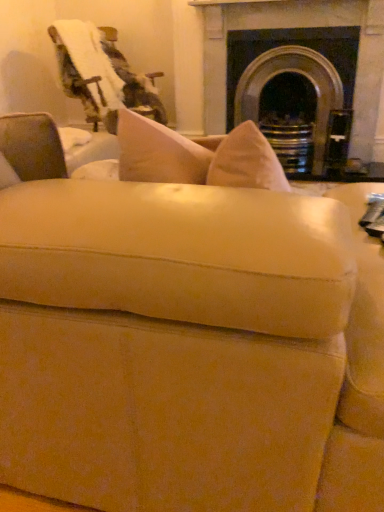
Measure the distance between point (88, 105) and camera.

3.45 meters.

You are a GUI agent. You are given a task and a screenshot of the screen. Output one action in this format:
    pyautogui.click(x=<x>, y=<y>)
    Task: Click on the velvet-like swivel chair at upper left
    
    Given the screenshot: What is the action you would take?
    pyautogui.click(x=101, y=75)

Describe the element at coordinates (101, 75) in the screenshot. I see `velvet-like swivel chair at upper left` at that location.

What are the coordinates of `dark gray stone fireplace at upper center` in the screenshot? It's located at (300, 27).

Describe the element at coordinates (300, 27) in the screenshot. The height and width of the screenshot is (512, 384). I see `dark gray stone fireplace at upper center` at that location.

Identify the location of velvet-like swivel chair at upper left. The height and width of the screenshot is (512, 384). (101, 75).

Which is more to the right, dark gray stone fireplace at upper center or velvet-like swivel chair at upper left?

dark gray stone fireplace at upper center is more to the right.

Is the position of dark gray stone fireplace at upper center more distant than that of velvet-like swivel chair at upper left?

That is True.

Considering the points (374, 73) and (99, 105), which point is in front, point (374, 73) or point (99, 105)?

The point (374, 73) is in front.

From the image's perspective, is dark gray stone fireplace at upper center above velvet-like swivel chair at upper left?

Yes, from the image's perspective, dark gray stone fireplace at upper center is over velvet-like swivel chair at upper left.

From a real-world perspective, which is physically below, dark gray stone fireplace at upper center or velvet-like swivel chair at upper left?

From a 3D spatial view, dark gray stone fireplace at upper center is below.

Looking at their sizes, would you say dark gray stone fireplace at upper center is wider or thinner than velvet-like swivel chair at upper left?

Clearly, dark gray stone fireplace at upper center has less width compared to velvet-like swivel chair at upper left.

Who is taller, dark gray stone fireplace at upper center or velvet-like swivel chair at upper left?

dark gray stone fireplace at upper center.

Considering the relative sizes of dark gray stone fireplace at upper center and velvet-like swivel chair at upper left in the image provided, is dark gray stone fireplace at upper center bigger than velvet-like swivel chair at upper left?

Indeed, dark gray stone fireplace at upper center has a larger size compared to velvet-like swivel chair at upper left.

Is dark gray stone fireplace at upper center spatially inside velvet-like swivel chair at upper left, or outside of it?

dark gray stone fireplace at upper center is outside velvet-like swivel chair at upper left.

Is dark gray stone fireplace at upper center placed right next to velvet-like swivel chair at upper left?

dark gray stone fireplace at upper center and velvet-like swivel chair at upper left are clearly separated.

Could you tell me if dark gray stone fireplace at upper center is turned towards velvet-like swivel chair at upper left?

No, dark gray stone fireplace at upper center is not turned towards velvet-like swivel chair at upper left.

How different are the orientations of dark gray stone fireplace at upper center and velvet-like swivel chair at upper left in degrees?

The angle between the facing direction of dark gray stone fireplace at upper center and the facing direction of velvet-like swivel chair at upper left is 59.8 degrees.

How distant is dark gray stone fireplace at upper center from velvet-like swivel chair at upper left?

dark gray stone fireplace at upper center and velvet-like swivel chair at upper left are 93.78 centimeters apart from each other.

You are a GUI agent. You are given a task and a screenshot of the screen. Output one action in this format:
    pyautogui.click(x=<x>, y=<y>)
    Task: Click on the swivel chair below the dark gray stone fireplace at upper center (from the image's perspective)
    The width and height of the screenshot is (384, 512).
    Given the screenshot: What is the action you would take?
    pyautogui.click(x=101, y=75)

Considering the relative positions of velvet-like swivel chair at upper left and dark gray stone fireplace at upper center in the image provided, is velvet-like swivel chair at upper left to the left or to the right of dark gray stone fireplace at upper center?

Based on their positions, velvet-like swivel chair at upper left is located to the left of dark gray stone fireplace at upper center.

Is velvet-like swivel chair at upper left further to the viewer compared to dark gray stone fireplace at upper center?

No.

Does point (89, 64) come behind point (360, 22)?

Yes.

From the image's perspective, does velvet-like swivel chair at upper left appear higher than dark gray stone fireplace at upper center?

No, from the image's perspective, velvet-like swivel chair at upper left is not over dark gray stone fireplace at upper center.

From a real-world perspective, which object stands above the other?

From a 3D spatial view, velvet-like swivel chair at upper left is above.

Is velvet-like swivel chair at upper left wider or thinner than dark gray stone fireplace at upper center?

In the image, velvet-like swivel chair at upper left appears to be wider than dark gray stone fireplace at upper center.

Looking at this image, who is shorter, velvet-like swivel chair at upper left or dark gray stone fireplace at upper center?

velvet-like swivel chair at upper left.

Considering the sizes of velvet-like swivel chair at upper left and dark gray stone fireplace at upper center in the image, is velvet-like swivel chair at upper left bigger or smaller than dark gray stone fireplace at upper center?

In the image, velvet-like swivel chair at upper left appears to be smaller than dark gray stone fireplace at upper center.

Would you say velvet-like swivel chair at upper left is outside dark gray stone fireplace at upper center?

velvet-like swivel chair at upper left is positioned outside dark gray stone fireplace at upper center.

Is velvet-like swivel chair at upper left positioned far away from dark gray stone fireplace at upper center?

No, velvet-like swivel chair at upper left is not far from dark gray stone fireplace at upper center.

Could you tell me if velvet-like swivel chair at upper left is facing dark gray stone fireplace at upper center?

No, velvet-like swivel chair at upper left is not oriented towards dark gray stone fireplace at upper center.

Based on the photo, how far apart are velvet-like swivel chair at upper left and dark gray stone fireplace at upper center?

velvet-like swivel chair at upper left is 36.92 inches away from dark gray stone fireplace at upper center.

At what (x,y) coordinates should I click in order to perform the action: click on swivel chair in front of the dark gray stone fireplace at upper center. Please return your answer as a coordinate pair (x, y). Looking at the image, I should click on (101, 75).

You are a GUI agent. You are given a task and a screenshot of the screen. Output one action in this format:
    pyautogui.click(x=<x>, y=<y>)
    Task: Click on the swivel chair in front of the dark gray stone fireplace at upper center
    
    Given the screenshot: What is the action you would take?
    pyautogui.click(x=101, y=75)

This screenshot has width=384, height=512. In the image, there is a dark gray stone fireplace at upper center. Identify the location of swivel chair below it (from the image's perspective). (101, 75).